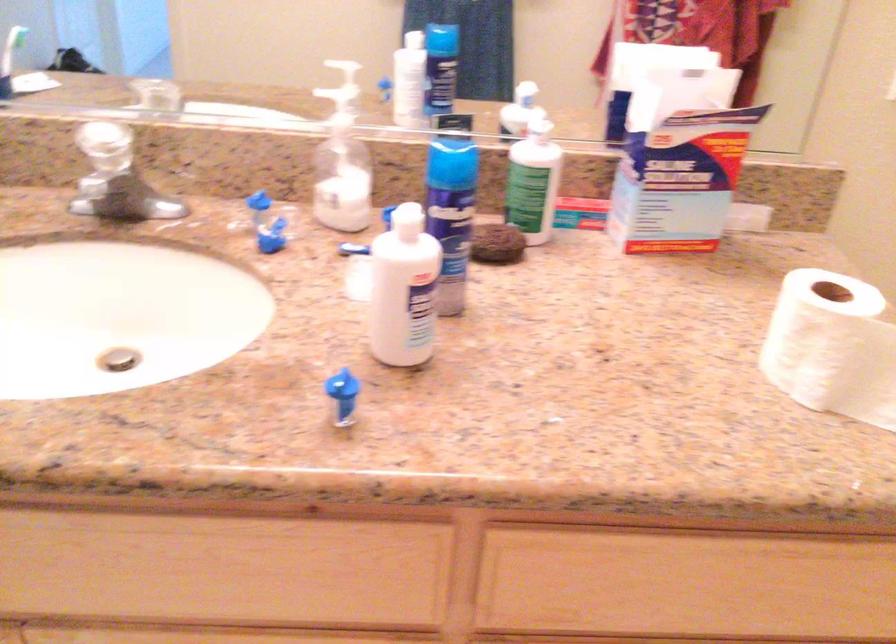
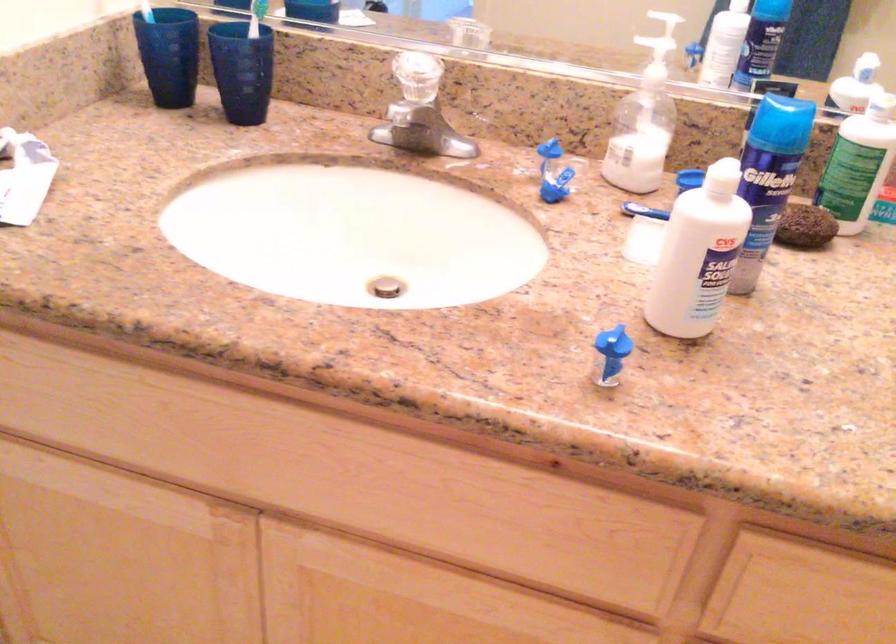
Find the pixel in the second image that matches pixel 453 162 in the first image.

(780, 124)